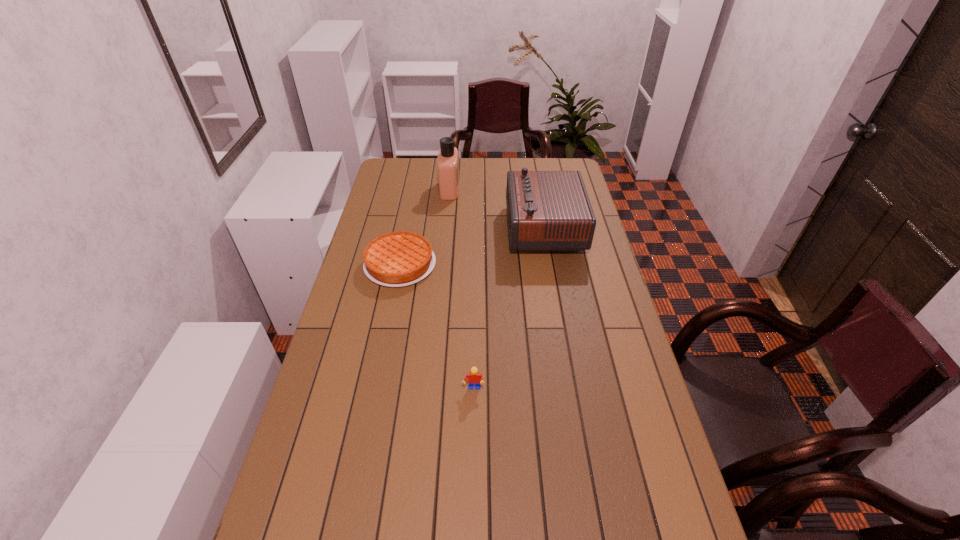
You are a GUI agent. You are given a task and a screenshot of the screen. Output one action in this format:
    pyautogui.click(x=<x>, y=<y>)
    Task: Click on the free space located 0.110m on the front panel of the radio receiver
    Image resolution: width=960 pixels, height=540 pixels.
    Given the screenshot: What is the action you would take?
    pyautogui.click(x=479, y=228)

You are a GUI agent. You are given a task and a screenshot of the screen. Output one action in this format:
    pyautogui.click(x=<x>, y=<y>)
    Task: Click on the blank space located 0.190m on the front-facing side of the Lego
    This screenshot has width=960, height=540.
    Given the screenshot: What is the action you would take?
    pyautogui.click(x=472, y=462)

You are a GUI agent. You are given a task and a screenshot of the screen. Output one action in this format:
    pyautogui.click(x=<x>, y=<y>)
    Task: Click on the free space located on the right of the shortest object
    
    Given the screenshot: What is the action you would take?
    pyautogui.click(x=461, y=265)

At what (x,y) coordinates should I click in order to perform the action: click on object present at the far edge. Please return your answer as a coordinate pair (x, y). The width and height of the screenshot is (960, 540). Looking at the image, I should click on [447, 162].

The height and width of the screenshot is (540, 960). I want to click on object at the left edge, so click(x=397, y=259).

Image resolution: width=960 pixels, height=540 pixels. I want to click on object at the right edge, so click(x=547, y=210).

Image resolution: width=960 pixels, height=540 pixels. I want to click on free space at the far edge of the desktop, so click(482, 168).

In the image, there is a desktop. Find the location of `free space at the left edge`. free space at the left edge is located at coordinates click(x=372, y=210).

Image resolution: width=960 pixels, height=540 pixels. Identify the location of vacant point at the right edge. (590, 299).

In the image, there is a desktop. At what (x,y) coordinates should I click in order to perform the action: click on vacant space at the far left corner. Please return your answer as a coordinate pair (x, y). Looking at the image, I should click on (414, 165).